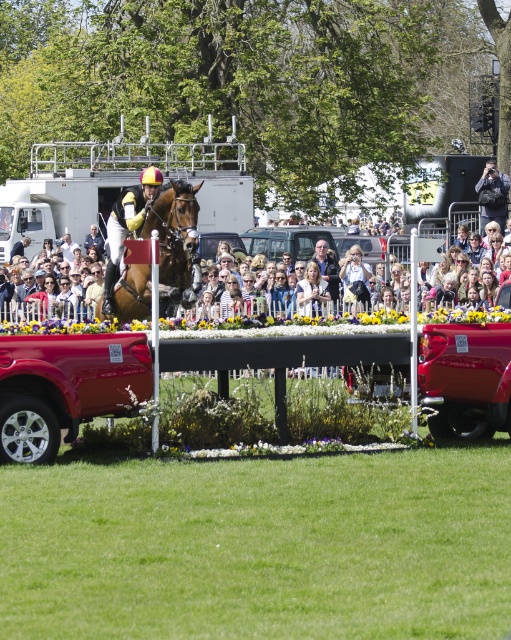
From the picture: Is matte brown horse at center to the left of brown glossy horse at center from the viewer's perspective?

Incorrect, matte brown horse at center is not on the left side of brown glossy horse at center.

Can you confirm if matte brown horse at center is positioned to the right of brown glossy horse at center?

Indeed, matte brown horse at center is positioned on the right side of brown glossy horse at center.

Between point (1, 324) and point (142, 192), which one is positioned in front?

Positioned in front is point (1, 324).

You are a GUI agent. You are given a task and a screenshot of the screen. Output one action in this format:
    pyautogui.click(x=<x>, y=<y>)
    Task: Click on the matte brown horse at center
    The width and height of the screenshot is (511, 640).
    Given the screenshot: What is the action you would take?
    pyautogui.click(x=276, y=314)

Between matte brown horse at center and light brown leather jacket at center, which one is positioned higher?

Positioned higher is light brown leather jacket at center.

Measure the distance between matte brown horse at center and camera.

matte brown horse at center and camera are 16.37 meters apart.

Who is more forward, (428, 298) or (340, 275)?

Point (428, 298) is more forward.

You are a GUI agent. You are given a task and a screenshot of the screen. Output one action in this format:
    pyautogui.click(x=<x>, y=<y>)
    Task: Click on the matte brown horse at center
    The height and width of the screenshot is (640, 511).
    Given the screenshot: What is the action you would take?
    276,314

Does matte brown horse at center have a larger size compared to light brown hair at center?

Correct, matte brown horse at center is larger in size than light brown hair at center.

Can you confirm if matte brown horse at center is positioned above light brown hair at center?

No, matte brown horse at center is not above light brown hair at center.

What do you see at coordinates (276, 314) in the screenshot?
I see `matte brown horse at center` at bounding box center [276, 314].

The height and width of the screenshot is (640, 511). Identify the location of matte brown horse at center. (276, 314).